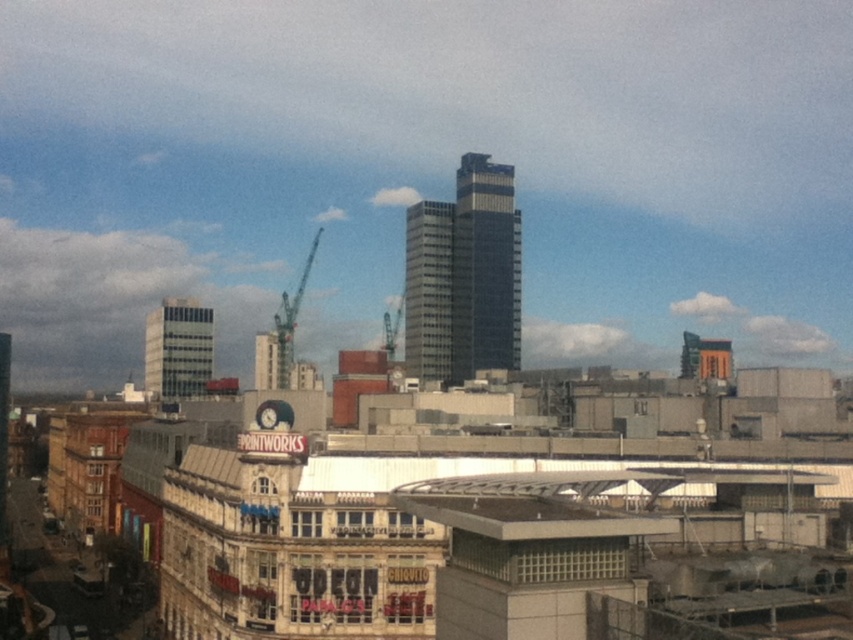
Which is more to the left, dark glass skyscraper at center or metallic gray crane at center?

From the viewer's perspective, metallic gray crane at center appears more on the left side.

Which is above, dark glass skyscraper at center or metallic gray crane at center?

Positioned higher is dark glass skyscraper at center.

From the picture: Who is more distant from viewer, [486,218] or [288,358]?

Point [486,218]

Locate an element on the screen. Image resolution: width=853 pixels, height=640 pixels. dark glass skyscraper at center is located at coordinates click(x=485, y=268).

Who is positioned more to the left, glassy silver skyscraper at center or white glass building at center-left?

From the viewer's perspective, white glass building at center-left appears more on the left side.

In the scene shown: Who is lower down, glassy silver skyscraper at center or white glass building at center-left?

white glass building at center-left is below.

The width and height of the screenshot is (853, 640). In order to click on glassy silver skyscraper at center in this screenshot , I will do `click(428, 291)`.

Can you confirm if dark glass skyscraper at center is smaller than white glass building at center-left?

Correct, dark glass skyscraper at center occupies less space than white glass building at center-left.

Between point (502, 214) and point (151, 326), which one is positioned in front?

Point (502, 214)

This screenshot has width=853, height=640. In order to click on dark glass skyscraper at center in this screenshot , I will do `click(485, 268)`.

Locate an element on the screen. This screenshot has width=853, height=640. dark glass skyscraper at center is located at coordinates (485, 268).